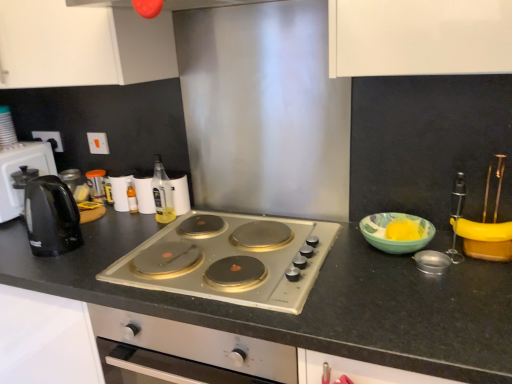
Locate an element on the screen. vacant area on top of matte green bowl at right (from a real-world perspective) is located at coordinates 398,224.